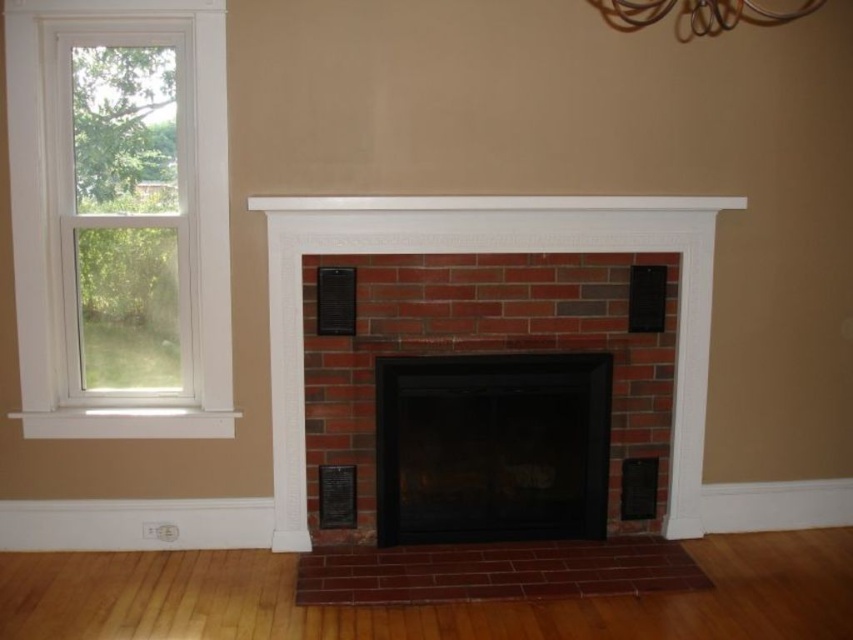
Who is lower down, clear glass window at left or white painted wood mantle at upper center?

clear glass window at left is lower down.

Locate an element on the screen. This screenshot has width=853, height=640. clear glass window at left is located at coordinates (67, 237).

Image resolution: width=853 pixels, height=640 pixels. I want to click on clear glass window at left, so click(x=67, y=237).

Based on the photo, can you confirm if black glass fireplace at center is wider than white painted wood mantle at upper center?

In fact, black glass fireplace at center might be narrower than white painted wood mantle at upper center.

Is black glass fireplace at center bigger than white painted wood mantle at upper center?

Correct, black glass fireplace at center is larger in size than white painted wood mantle at upper center.

Who is more distant from viewer, [453,387] or [257,205]?

Point [453,387]

This screenshot has width=853, height=640. What are the coordinates of `black glass fireplace at center` in the screenshot? It's located at (x=491, y=445).

Describe the element at coordinates (67, 237) in the screenshot. I see `clear glass window at left` at that location.

Find the location of a particular element. The image size is (853, 640). clear glass window at left is located at coordinates (67, 237).